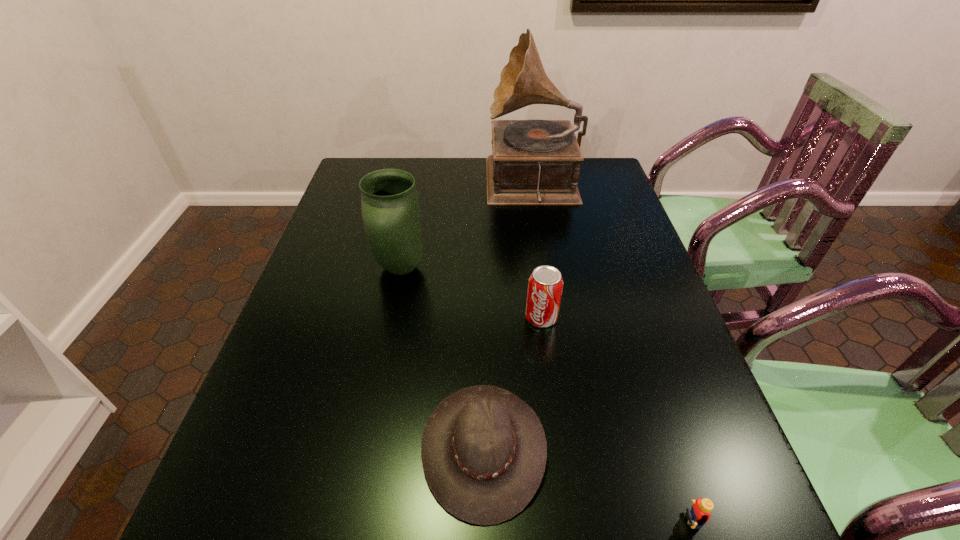
Image resolution: width=960 pixels, height=540 pixels. I want to click on object that can be found as the closest to the farthest object, so click(x=390, y=208).

This screenshot has height=540, width=960. What are the coordinates of `the fourth closest object to the hat` in the screenshot? It's located at (534, 162).

Locate an element on the screen. This screenshot has width=960, height=540. free spot that satisfies the following two spatial constraints: 1. from the horn of the record player; 2. on the front side of the third tallest object is located at coordinates (555, 318).

You are a GUI agent. You are given a task and a screenshot of the screen. Output one action in this format:
    pyautogui.click(x=<x>, y=<y>)
    Task: Click on the vacant area in the image that satisfies the following two spatial constraints: 1. on the front side of the leftmost object; 2. on the left side of the third shortest object
    This screenshot has width=960, height=540.
    Given the screenshot: What is the action you would take?
    coord(391,318)